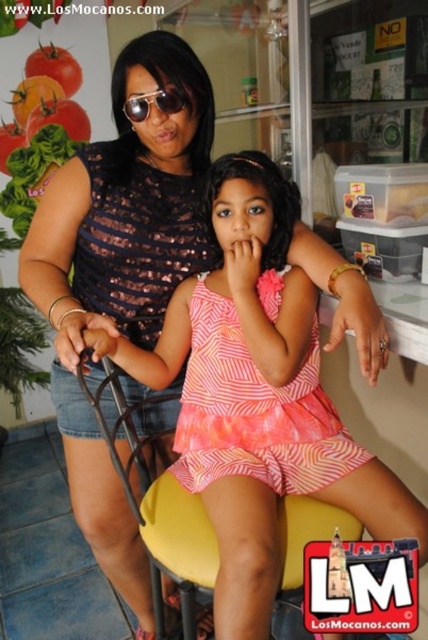
Question: Based on their relative distances, which object is nearer to the pink tie-dye dress at center?

Choices:
 (A) pink zebra-patterned dress at center
 (B) yellow fabric chair at center
 (C) shiny metallic sunglasses at center

Answer: (A)

Question: Does yellow fabric chair at center appear over shiny metallic sunglasses at center?

Choices:
 (A) yes
 (B) no

Answer: (B)

Question: Does pink zebra-patterned dress at center appear on the right side of yellow fabric chair at center?

Choices:
 (A) yes
 (B) no

Answer: (A)

Question: Which of the following is the closest to the observer?

Choices:
 (A) (217, 465)
 (B) (287, 536)

Answer: (B)

Question: Does pink tie-dye dress at center have a smaller size compared to shiny metallic sunglasses at center?

Choices:
 (A) no
 (B) yes

Answer: (A)

Question: Estimate the real-world distances between objects in this image. Which object is closer to the pink tie-dye dress at center?

Choices:
 (A) yellow fabric chair at center
 (B) shiny metallic sunglasses at center

Answer: (A)